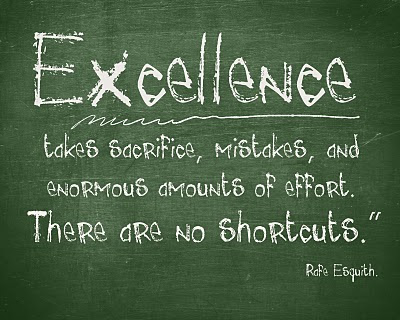
Identify the location of big scratches on wall. pos(376,134), pos(145,253), pos(190,251), pos(93,178).